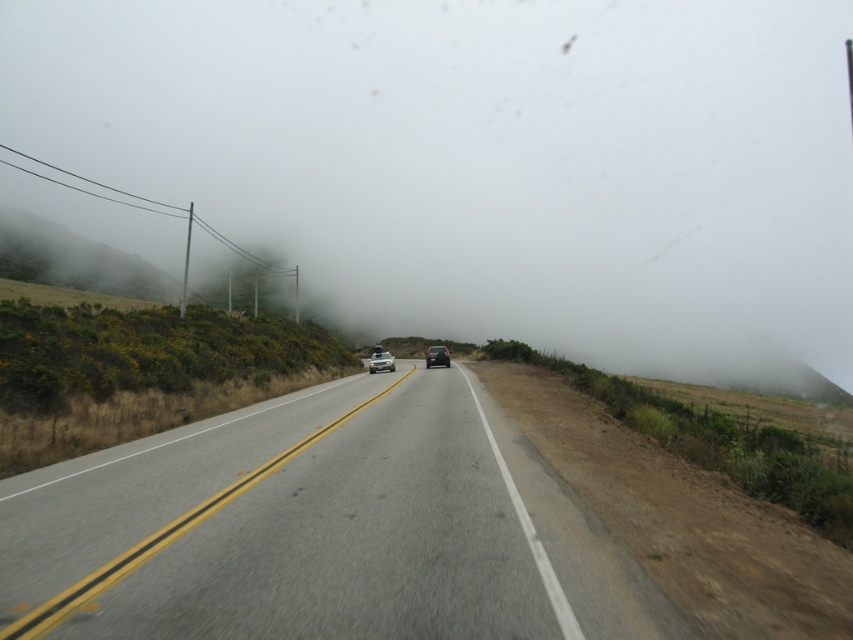
You are a driver approaching the satin silver sedan at center on a foggy road. The sedan is blocking your path. Can you safely navigate around it using the other lane? Consider the road has two lanes and the sedan is at the specified coordinates.

The satin silver sedan at center is positioned at coordinates (381, 362). Since the road has two lanes, you can safely navigate around it by moving into the opposite lane if it is clear of oncoming traffic.

You are driving a car and see the point at coordinates (734, 273) in the distance. If your car can stop in 200 meters, will you be able to stop before reaching that point?

The point at coordinates (734, 273) is 221.34 meters away from the camera. Since your car can stop in 200 meters, you will not be able to stop before reaching that point.

You are driving a car and see the satin silver sedan at center and the foggy mist at center in the distance. Which object is positioned more to the right from your perspective?

The foggy mist at center is to the right of the satin silver sedan at center, so the foggy mist at center is positioned more to the right.